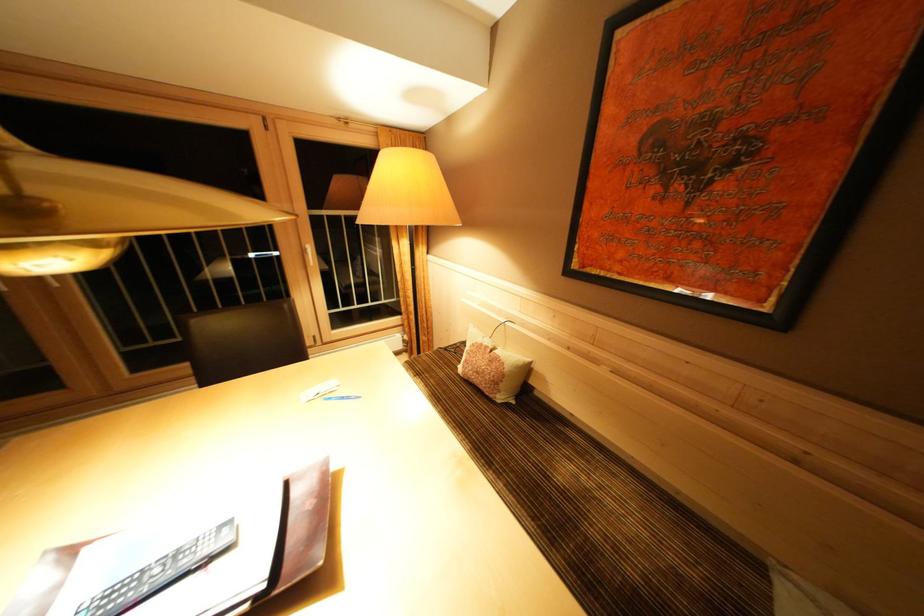
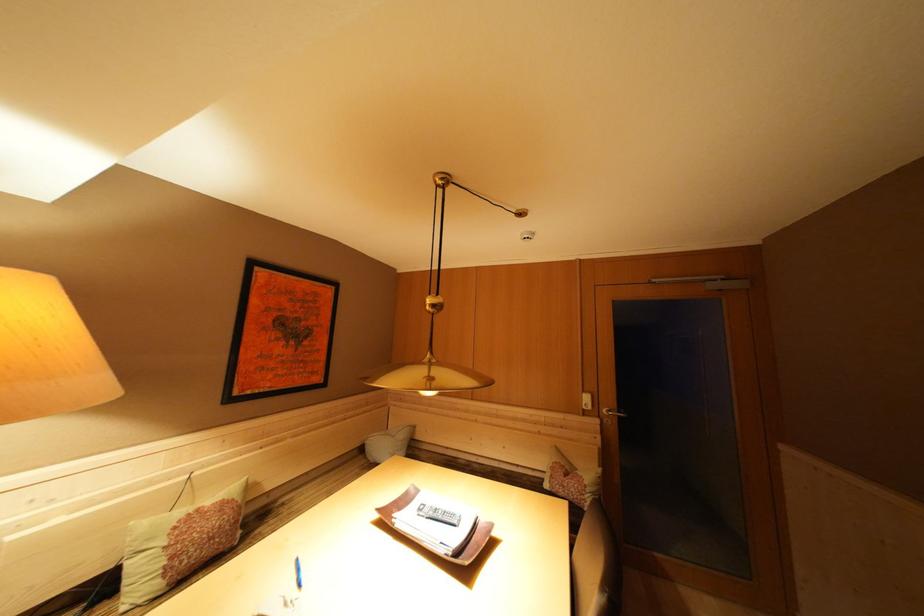
The point at [493,352] is marked in the first image. Where is the corresponding point in the second image?

(204, 515)